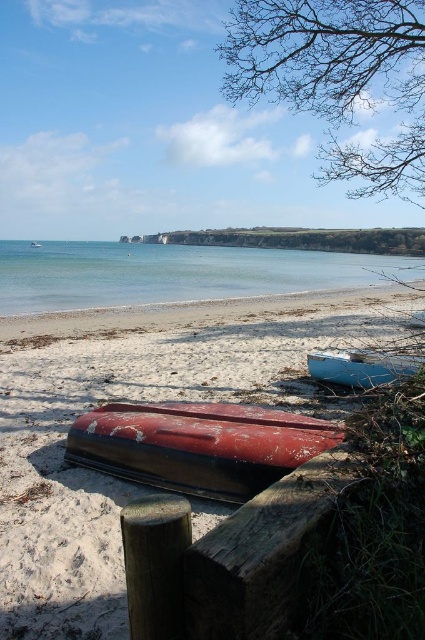
You are standing on the beach and want to walk to the light blue wooden boat at center. Which direction should you head to avoid the rusty wood canoe at lower left?

You should head to the right of the rusty wood canoe at lower left to reach the light blue wooden boat at center since the rusty wood canoe is to the left of it.

You are a beachgoer trying to decide which boat to use for a short trip. The rusty wood canoe at lower left and the light blue wooden boat at center are both available. Based on their widths, which boat might be more stable for carrying a small load?

The rusty wood canoe at lower left might be wider than the light blue wooden boat at center, so it could provide more stability for carrying a small load.

You are standing at the origin point in the image and want to reach the point labeled as point (365, 353). There is an obstacle at point (295, 252). Will you encounter the obstacle on your way?

Point (295, 252) is behind point (365, 353), so you will not encounter the obstacle on your way to point (365, 353).